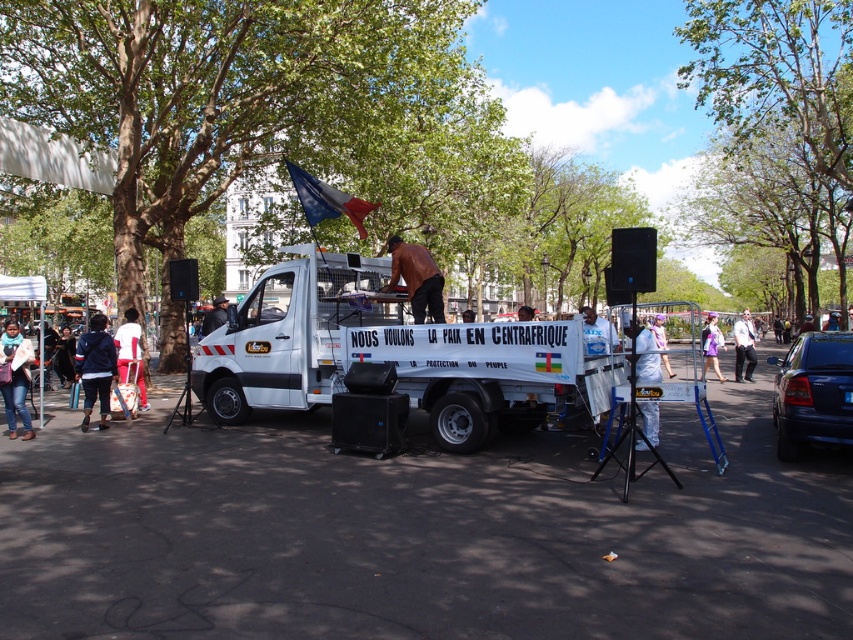
Question: Estimate the real-world distances between objects in this image. Which object is closer to the dark brown leather jacket at lower left?

Choices:
 (A) white fabric bag at left
 (B) brown leather shirt at center

Answer: (A)

Question: Is dark blue jacket at left above white fabric canopy at center?

Choices:
 (A) no
 (B) yes

Answer: (A)

Question: Is green leafy tree at upper center to the left of white fabric canopy at center from the viewer's perspective?

Choices:
 (A) no
 (B) yes

Answer: (A)

Question: Which object appears closest to the camera in this image?

Choices:
 (A) dark blue jacket at left
 (B) green leafy tree at upper center
 (C) blue metallic sedan at right
 (D) white matte food truck at center

Answer: (C)

Question: Can you confirm if white shirt at center is positioned to the right of dark brown leather jacket at lower left?

Choices:
 (A) yes
 (B) no

Answer: (A)

Question: Among these objects, which one is farthest from the camera?

Choices:
 (A) dark blue jacket at left
 (B) white fabric bag at left
 (C) green leafy tree at upper left

Answer: (C)